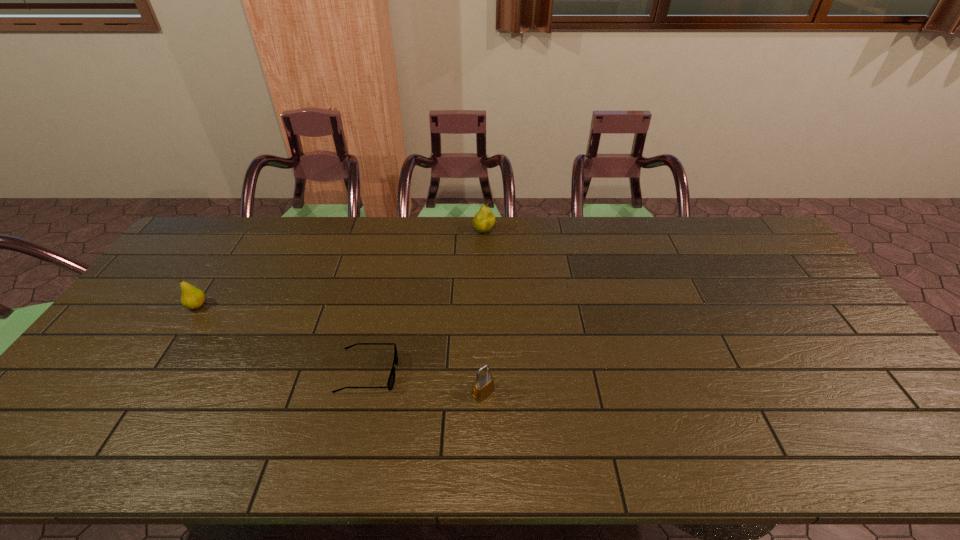
Locate an element on the screen. The height and width of the screenshot is (540, 960). vacant region located on the front-facing side of the spectacles is located at coordinates (513, 373).

The width and height of the screenshot is (960, 540). Identify the location of object present at the far edge. (484, 219).

The width and height of the screenshot is (960, 540). In order to click on object that is at the left edge in this screenshot , I will do point(192,298).

Where is `vacant space at the far edge of the desktop`? Image resolution: width=960 pixels, height=540 pixels. vacant space at the far edge of the desktop is located at coordinates (374, 228).

Image resolution: width=960 pixels, height=540 pixels. In the image, there is a desktop. What are the coordinates of `vacant space at the near edge` in the screenshot? It's located at (817, 456).

Image resolution: width=960 pixels, height=540 pixels. In order to click on blank area at the left edge in this screenshot , I will do `click(130, 354)`.

In the image, there is a desktop. At what (x,y) coordinates should I click in order to perform the action: click on vacant space at the right edge. Please return your answer as a coordinate pair (x, y). The image size is (960, 540). Looking at the image, I should click on (891, 388).

Find the location of a particular element. free region at the far left corner of the desktop is located at coordinates (212, 247).

Where is `blank region between the padlock and the leftmost object`? The height and width of the screenshot is (540, 960). blank region between the padlock and the leftmost object is located at coordinates (340, 349).

Find the location of a particular element. Image resolution: width=960 pixels, height=540 pixels. free spot between the second farthest object and the padlock is located at coordinates (340, 349).